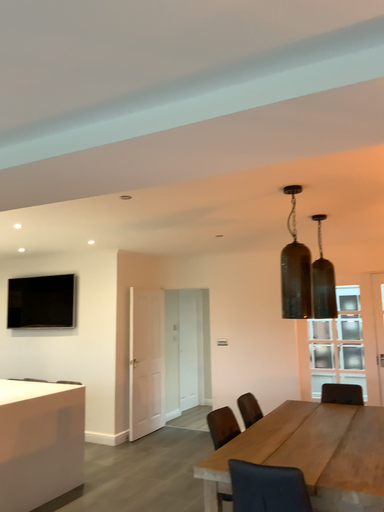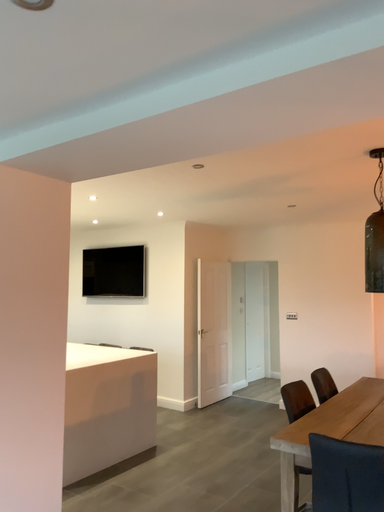
Question: How did the camera likely rotate when shooting the video?

Choices:
 (A) rotated right
 (B) rotated left

Answer: (B)